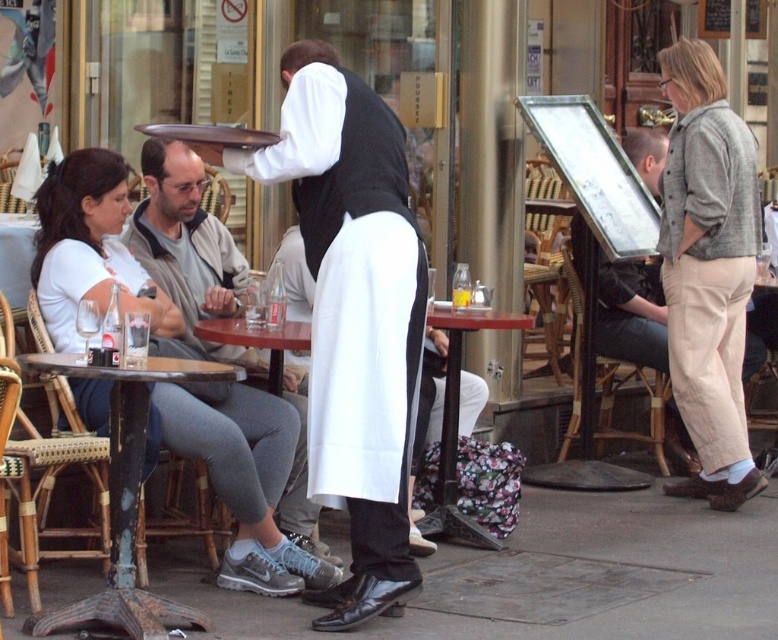
You are a customer at this European outdoor cafe and want to sit at the wooden table at center. There is a matte gray jacket at left on the chair. Can you tell if the jacket will fit on the chair without falling off?

The matte gray jacket at left is larger than the wooden table at center. However, the size comparison between the jacket and the table does not directly indicate if the jacket will fit on the chair. The jacket might be too large for the chair, but we need more information about the chair size or the jacket dimensions relative to the chair.

You are standing at point (x=146, y=221) and want to walk to point (x=736, y=410). Given the layout of the European style outdoor cafe, will you be able to walk directly to your destination without any obstacles?

Point (x=736, y=410) is behind point (x=146, y=221), so you will need to walk around or move past point (x=146, y=221) to reach your destination.